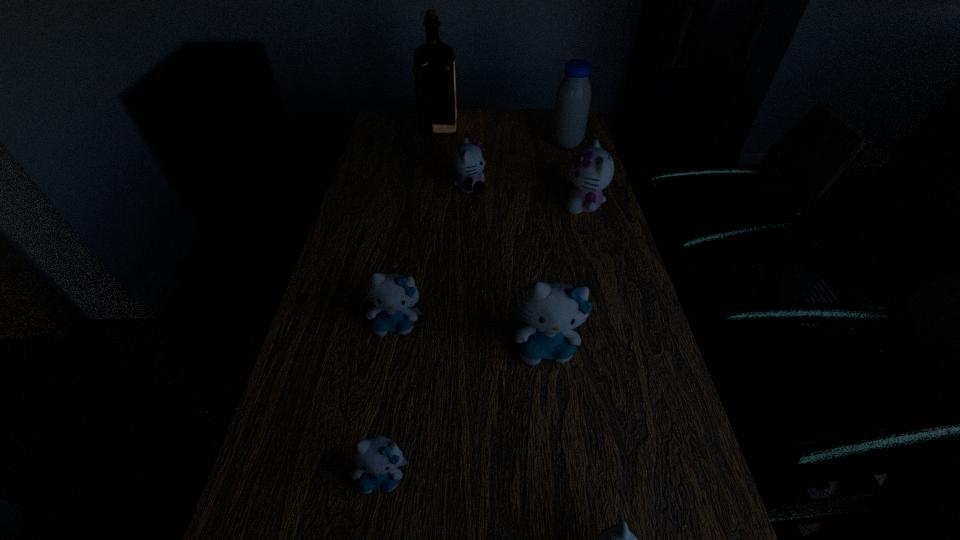
Where is `liquor`? Image resolution: width=960 pixels, height=540 pixels. liquor is located at coordinates (434, 61).

Image resolution: width=960 pixels, height=540 pixels. I want to click on the seventh shortest object, so click(572, 103).

Locate an element on the screen. soya milk is located at coordinates (572, 103).

You are a GUI agent. You are given a task and a screenshot of the screen. Output one action in this format:
    pyautogui.click(x=<x>, y=<y>)
    Task: Click on the rightmost kitten
    Image resolution: width=960 pixels, height=540 pixels.
    Given the screenshot: What is the action you would take?
    pyautogui.click(x=592, y=170)

At what (x,y) coordinates should I click in order to perform the action: click on the rightmost white kitten. Please return your answer as a coordinate pair (x, y). Looking at the image, I should click on (592, 170).

Locate an element on the screen. the rightmost blue kitten is located at coordinates (551, 310).

This screenshot has width=960, height=540. Identify the location of the leftmost white kitten. (467, 159).

The height and width of the screenshot is (540, 960). Identify the location of the third kitten from left to right. (467, 159).

You are a GUI agent. You are given a task and a screenshot of the screen. Output one action in this format:
    pyautogui.click(x=<x>, y=<y>)
    Task: Click on the second smallest blue kitten
    The image size is (960, 540).
    Given the screenshot: What is the action you would take?
    pyautogui.click(x=393, y=295)

The width and height of the screenshot is (960, 540). In order to click on the second nearest object in this screenshot , I will do `click(377, 459)`.